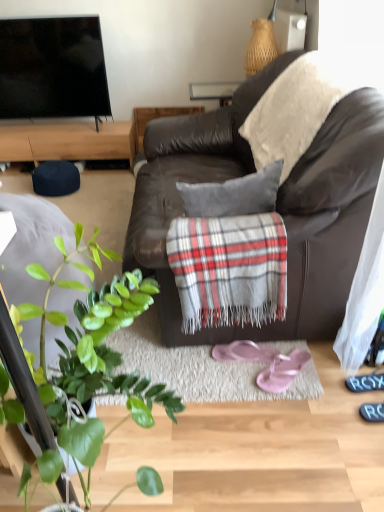
Question: Is point (178, 221) positioned closer to the camera than point (382, 387)?

Choices:
 (A) closer
 (B) farther

Answer: (A)

Question: Is plaid fabric at center taller or shorter than black rubber shoe at lower right?

Choices:
 (A) short
 (B) tall

Answer: (B)

Question: Which object is positioned closest to the wooden cabinet at upper left?

Choices:
 (A) green leafy plant at lower left
 (B) pink fabric flip-flops at center, arranged as the second footwear when viewed from the right
 (C) plaid fabric at center
 (D) pink rubber flip-flops at lower center, positioned as the 1th footwear in right-to-left order
 (E) brown leather couch at center

Answer: (E)

Question: Estimate the real-world distances between objects in this image. Which object is farther from the pink rubber flip-flops at lower center, the 2th footwear viewed from the left?

Choices:
 (A) plaid fabric at center
 (B) brown leather couch at center
 (C) pink fabric flip-flops at center, arranged as the second footwear when viewed from the right
 (D) wooden cabinet at upper left
 (E) green leafy plant at lower left

Answer: (D)